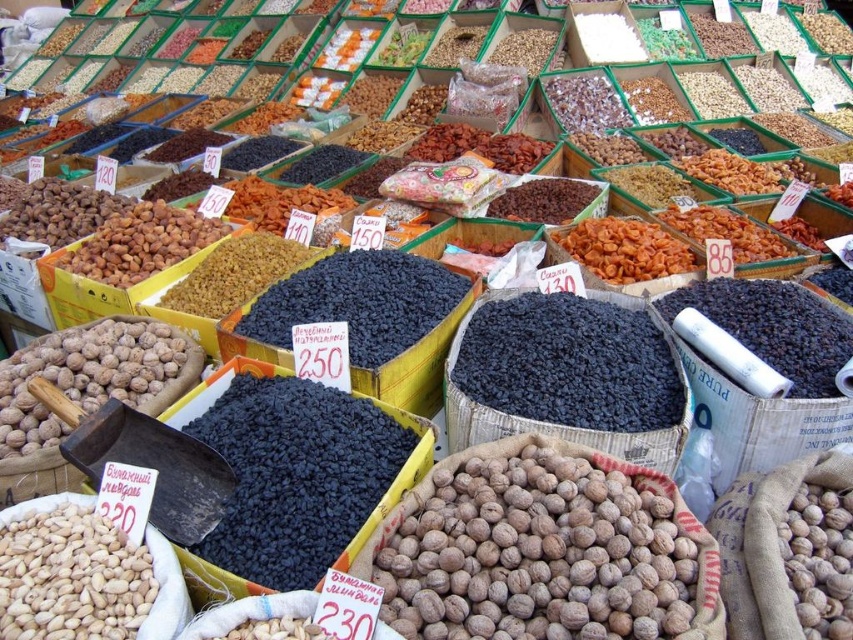
Question: Which of these objects is positioned closest to the dark matte raisins at center?

Choices:
 (A) dark blue dried fruit at center
 (B) brown matte nuts at center

Answer: (B)

Question: Which is farther from the dark blue dried fruit at center?

Choices:
 (A) white matte nuts at lower left
 (B) brown matte nuts at center
 (C) brown rough walnut at lower right

Answer: (B)

Question: Does dark matte raisins at center appear under brown rough walnut at lower right?

Choices:
 (A) yes
 (B) no

Answer: (B)

Question: Is dark matte raisins at center wider than white matte nuts at lower left?

Choices:
 (A) no
 (B) yes

Answer: (B)

Question: Can you confirm if brown matte nuts at center is bigger than brown rough walnut at lower right?

Choices:
 (A) yes
 (B) no

Answer: (A)

Question: Which point is closer to the camera taking this photo?

Choices:
 (A) (103, 371)
 (B) (328, 552)
 (C) (392, 605)
 (D) (827, 515)

Answer: (C)